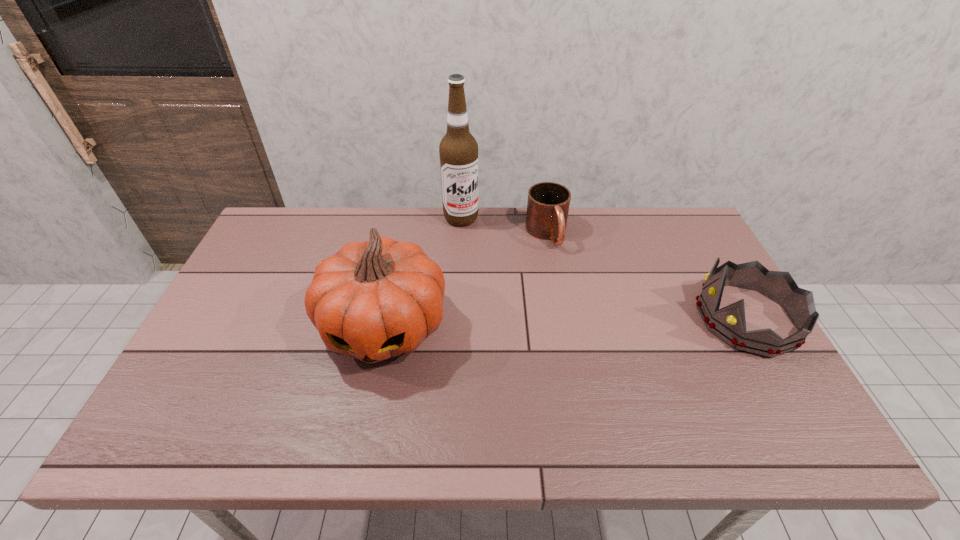
This screenshot has height=540, width=960. Identify the location of vacant region located 0.370m on the side of the third object from left to right with the handle. (604, 345).

Locate an element on the screen. This screenshot has width=960, height=540. vacant point located 0.370m on the side of the third object from left to right with the handle is located at coordinates (604, 345).

Locate an element on the screen. This screenshot has height=540, width=960. vacant space positioned 0.300m on the side of the third object from left to right with the handle is located at coordinates (593, 324).

Where is `vacant region located on the label of the tallest object`? The height and width of the screenshot is (540, 960). vacant region located on the label of the tallest object is located at coordinates (484, 262).

This screenshot has width=960, height=540. I want to click on vacant area located on the label of the tallest object, so click(499, 293).

Where is `vacant area located 0.060m on the label of the tallest object`? Image resolution: width=960 pixels, height=540 pixels. vacant area located 0.060m on the label of the tallest object is located at coordinates (472, 239).

Where is `mug that is at the far edge`? mug that is at the far edge is located at coordinates (548, 203).

You are a GUI agent. You are given a task and a screenshot of the screen. Output one action in this format:
    pyautogui.click(x=<x>, y=<y>)
    Task: Click on the alcohol present at the far edge
    
    Given the screenshot: What is the action you would take?
    pyautogui.click(x=458, y=150)

You are a GUI agent. You are given a task and a screenshot of the screen. Output one action in this format:
    pyautogui.click(x=<x>, y=<y>)
    Task: Click on the object that is at the near edge
    Image resolution: width=960 pixels, height=540 pixels.
    Given the screenshot: What is the action you would take?
    pyautogui.click(x=373, y=300)

Where is `object that is at the right edge`? Image resolution: width=960 pixels, height=540 pixels. object that is at the right edge is located at coordinates (728, 323).